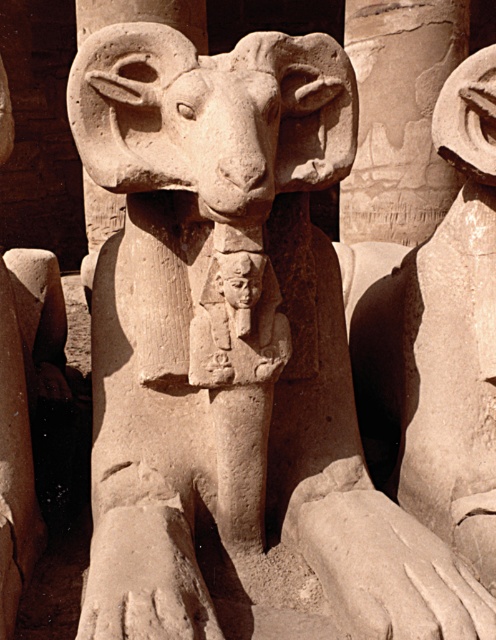
Who is positioned more to the right, smooth stone column at center or smooth stone ram at center?

Positioned to the right is smooth stone column at center.

Is smooth stone column at center to the right of smooth stone ram at center from the viewer's perspective?

Indeed, smooth stone column at center is positioned on the right side of smooth stone ram at center.

The image size is (496, 640). Describe the element at coordinates (399, 116) in the screenshot. I see `smooth stone column at center` at that location.

Identify the location of smooth stone column at center. Image resolution: width=496 pixels, height=640 pixels. (399, 116).